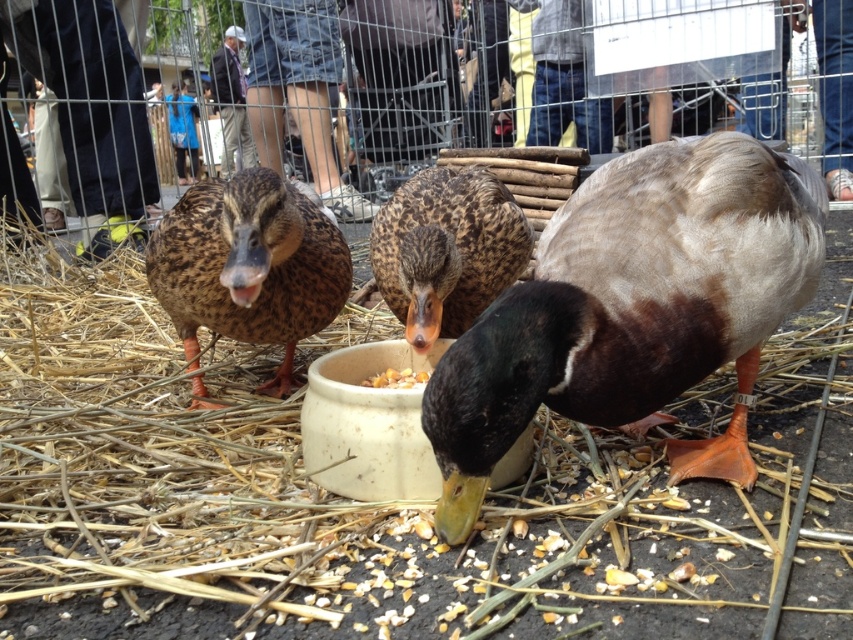
Question: Which is nearer to the brown speckled feathers at left?

Choices:
 (A) yellow grain at center
 (B) brown speckled feathers at center

Answer: (B)

Question: Is brown speckled feathers at left thinner than brown speckled feathers at center?

Choices:
 (A) no
 (B) yes

Answer: (A)

Question: Among these points, which one is farthest from the camera?

Choices:
 (A) (426, 177)
 (B) (387, 378)
 (C) (213, 328)

Answer: (A)

Question: Does brown feathered duck at center have a smaller size compared to brown speckled feathers at center?

Choices:
 (A) yes
 (B) no

Answer: (B)

Question: Which of the following is the closest to the observer?

Choices:
 (A) (x=495, y=221)
 (B) (x=326, y=301)
 (C) (x=744, y=209)
 (D) (x=389, y=380)

Answer: (C)

Question: Can you confirm if brown feathered duck at center is positioned to the right of brown speckled feathers at left?

Choices:
 (A) yes
 (B) no

Answer: (A)